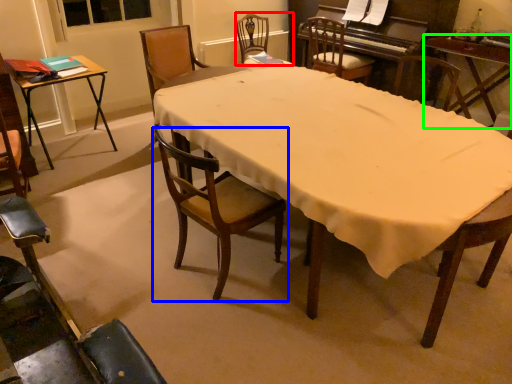
Question: Considering the real-world distances, which object is farthest from chair (highlighted by a red box)? chair (highlighted by a blue box) or table (highlighted by a green box)?

Choices:
 (A) chair
 (B) table

Answer: (A)